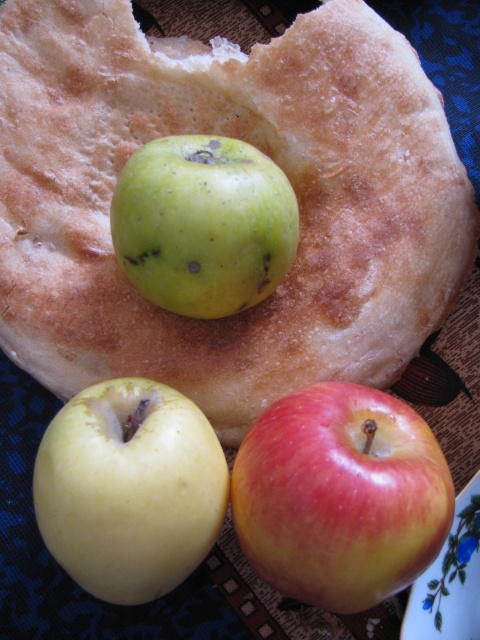
Who is shorter, yellow matte apple at center or green matte apple at center?

Standing shorter between the two is green matte apple at center.

Consider the image. Is yellow matte apple at center below green matte apple at center?

Yes, yellow matte apple at center is below green matte apple at center.

Who is more distant from viewer, (86, 451) or (282, 211)?

Positioned behind is point (282, 211).

Locate an element on the screen. Image resolution: width=480 pixels, height=640 pixels. yellow matte apple at center is located at coordinates (130, 488).

Can you confirm if green matte apple at upper center is positioned above yellow matte apple at center?

Correct, green matte apple at upper center is located above yellow matte apple at center.

Which is in front, point (15, 340) or point (69, 417)?

Positioned in front is point (69, 417).

Is point (434, 128) farther from camera compared to point (36, 477)?

Yes, it is.

This screenshot has height=640, width=480. In order to click on green matte apple at upper center in this screenshot , I will do `click(259, 147)`.

In the scene shown: Can you confirm if green matte apple at upper center is wider than red-yellow smooth apple at lower right?

Correct, the width of green matte apple at upper center exceeds that of red-yellow smooth apple at lower right.

Can you confirm if green matte apple at upper center is bigger than red-yellow smooth apple at lower right?

Yes, green matte apple at upper center is bigger than red-yellow smooth apple at lower right.

Is point (349, 28) less distant than point (406, 536)?

No, (349, 28) is further to viewer.

Find the location of a particular element. This screenshot has height=640, width=480. green matte apple at upper center is located at coordinates (259, 147).